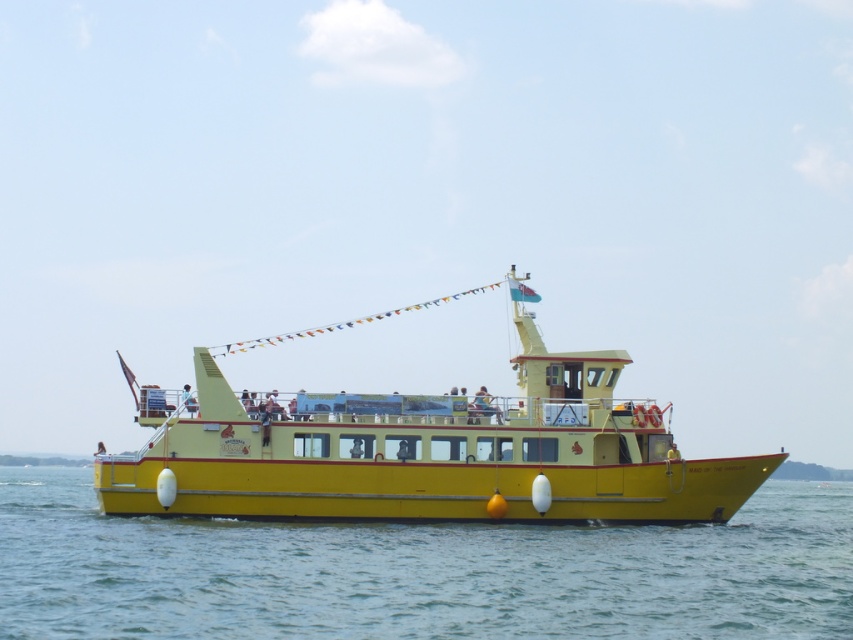
Question: Which point is closer to the camera?

Choices:
 (A) (177, 504)
 (B) (634, 564)

Answer: (B)

Question: Is yellow matte water at lower center behind yellow matte boat at center?

Choices:
 (A) yes
 (B) no

Answer: (B)

Question: Among these objects, which one is nearest to the camera?

Choices:
 (A) yellow matte water at lower center
 (B) yellow matte boat at center

Answer: (A)

Question: Which point is farther to the camera?

Choices:
 (A) (762, 465)
 (B) (399, 531)

Answer: (A)

Question: Does yellow matte water at lower center appear on the right side of yellow matte boat at center?

Choices:
 (A) no
 (B) yes

Answer: (B)

Question: Observing the image, what is the correct spatial positioning of yellow matte water at lower center in reference to yellow matte boat at center?

Choices:
 (A) right
 (B) left

Answer: (A)